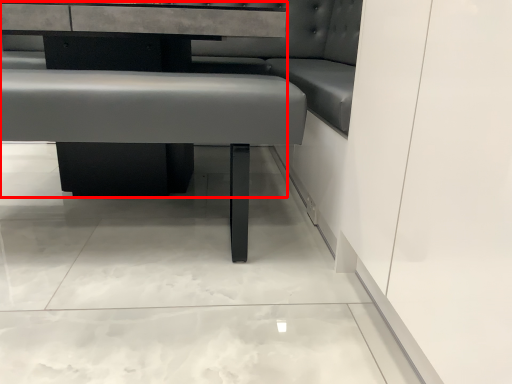
Question: From the image's perspective, what is the correct spatial relationship of table (annotated by the red box) in relation to vanity?

Choices:
 (A) above
 (B) below

Answer: (A)